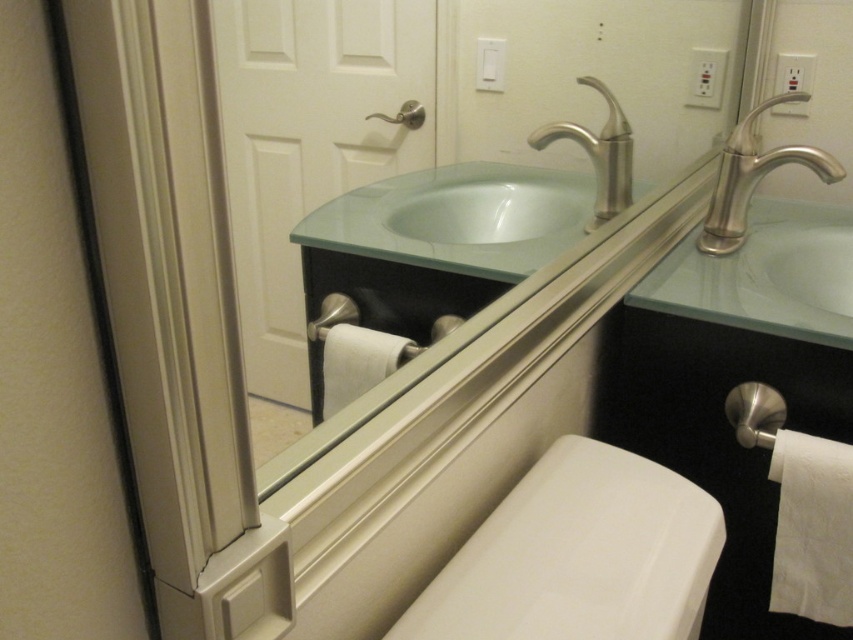
You are standing in the bathroom and need to determine which object is wider between the satin nickel faucet at upper right and the white matte toilet paper at lower center. Based on the reflection in the mirror, can you tell which one is wider?

The satin nickel faucet at upper right is wider than the white matte toilet paper at lower center according to the reflection in the mirror.

You are standing in the bathroom and want to reach the satin nickel faucet at upper right. If your arm can extend 3 feet, can you comfortably reach it without moving closer?

The satin nickel faucet at upper right is 3.68 feet away from the viewer. Since your arm can only extend 3 feet, you cannot comfortably reach it without moving closer.

You are standing in a bathroom and looking at the mirror. You want to reach a point marked at coordinates point (x=358, y=346) in the mirror. If your arm can extend 36 inches, can you reach that point?

The point (x=358, y=346) is 36.63 inches away from you, so your arm can not reach it since it can only extend 36 inches.